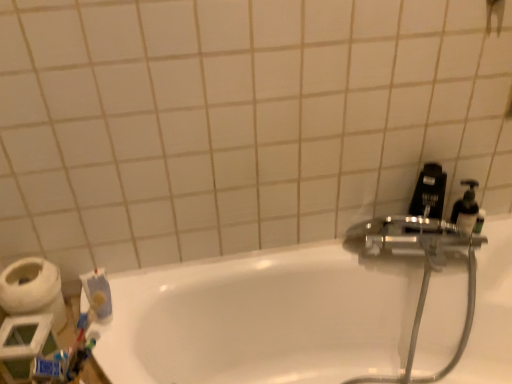
Question: From a real-world perspective, is white matte toilet paper at lower left located beneath shiny metallic hose at upper right?

Choices:
 (A) no
 (B) yes

Answer: (A)

Question: Can you confirm if white matte toilet paper at lower left is thinner than shiny metallic hose at upper right?

Choices:
 (A) no
 (B) yes

Answer: (B)

Question: Is the surface of white matte toilet paper at lower left in direct contact with shiny metallic hose at upper right?

Choices:
 (A) no
 (B) yes

Answer: (A)

Question: Is shiny metallic hose at upper right completely or partially inside white matte toilet paper at lower left?

Choices:
 (A) no
 (B) yes

Answer: (A)

Question: Is white matte toilet paper at lower left located outside shiny metallic hose at upper right?

Choices:
 (A) no
 (B) yes

Answer: (B)

Question: Can you confirm if white matte toilet paper at lower left is shorter than shiny metallic hose at upper right?

Choices:
 (A) no
 (B) yes

Answer: (B)

Question: Could white glossy bathtub at center be considered to be inside shiny metallic hose at upper right?

Choices:
 (A) yes
 (B) no

Answer: (B)

Question: Could you tell me if shiny metallic hose at upper right is turned towards white glossy bathtub at center?

Choices:
 (A) no
 (B) yes

Answer: (B)

Question: Is shiny metallic hose at upper right to the right of white glossy bathtub at center from the viewer's perspective?

Choices:
 (A) no
 (B) yes

Answer: (B)

Question: Considering the relative sizes of shiny metallic hose at upper right and white glossy bathtub at center in the image provided, is shiny metallic hose at upper right smaller than white glossy bathtub at center?

Choices:
 (A) yes
 (B) no

Answer: (A)

Question: Does shiny metallic hose at upper right have a larger size compared to white glossy bathtub at center?

Choices:
 (A) no
 (B) yes

Answer: (A)

Question: Is shiny metallic hose at upper right beside white glossy bathtub at center?

Choices:
 (A) yes
 (B) no

Answer: (B)

Question: Is blue matte toothpaste at lower left not close to white glossy bathtub at center?

Choices:
 (A) no
 (B) yes

Answer: (A)